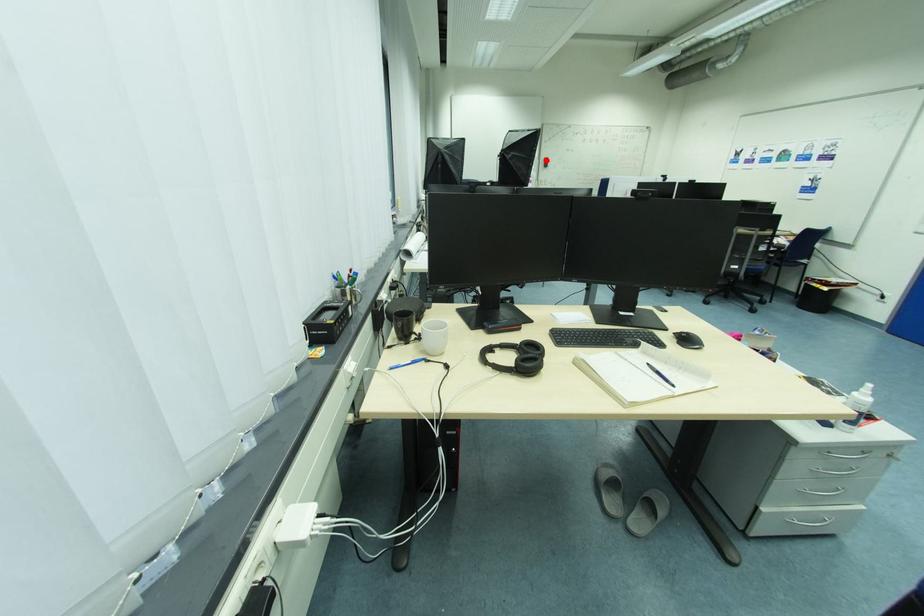
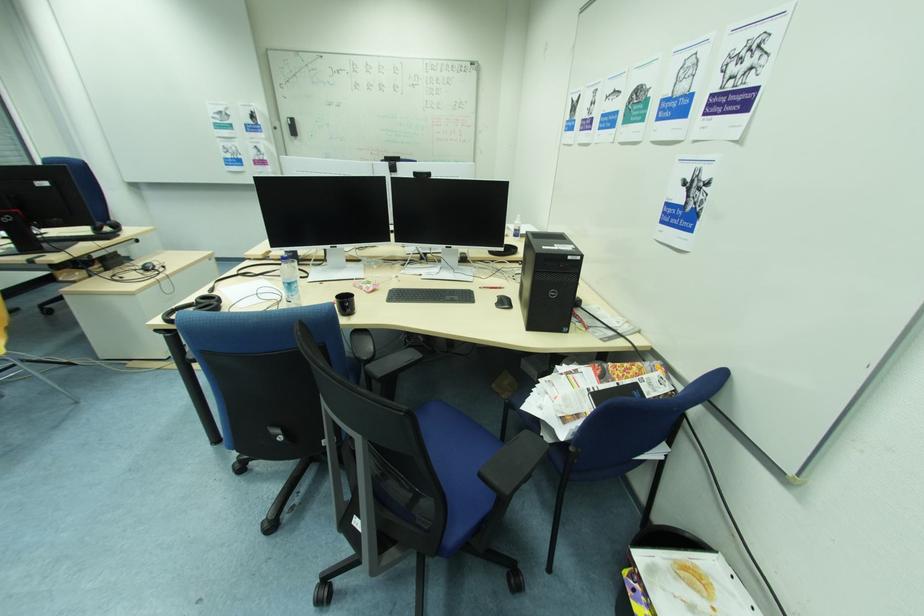
Locate, in the second image, the point that corresponds to the highlighted location in the first image.

(286, 122)